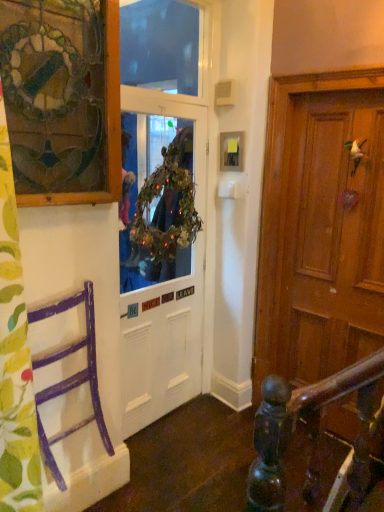
Question: Is point (231, 146) positioned closer to the camera than point (135, 198)?

Choices:
 (A) closer
 (B) farther

Answer: (B)

Question: Is wooden picture frame at upper center, which is counted as the 2th picture frame, starting from the left, situated inside green leafy wreath at center, the first window screen ordered from the bottom, or outside?

Choices:
 (A) outside
 (B) inside

Answer: (A)

Question: Which object is the farthest from the purple painted wood chair at left?

Choices:
 (A) transparent plastic window screen at upper center, the second window screen positioned from the bottom
 (B) wooden picture frame at upper center, which is counted as the 2th picture frame, starting from the left
 (C) green leafy wreath at center, marked as the second window screen in a top-to-bottom arrangement
 (D) stained glass window at upper left, placed as the 1th picture frame when sorted from front to back
 (E) green leafy fabric at left

Answer: (A)

Question: Estimate the real-world distances between objects in this image. Which object is farther from the green leafy fabric at left?

Choices:
 (A) green leafy wreath at center, marked as the second window screen in a top-to-bottom arrangement
 (B) white matte door at center
 (C) transparent plastic window screen at upper center, the second window screen positioned from the bottom
 (D) wooden picture frame at upper center, which ranks as the 1th picture frame in right-to-left order
 (E) stained glass window at upper left, the second picture frame in the right-to-left sequence

Answer: (C)